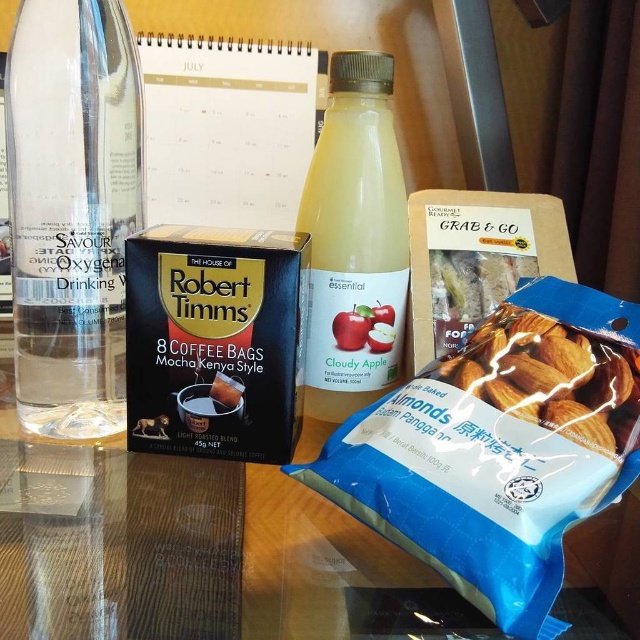
Does cloudy apple juice at center come behind smooth almond at lower right?

Yes, it is behind smooth almond at lower right.

Can you confirm if cloudy apple juice at center is positioned below smooth almond at lower right?

Incorrect, cloudy apple juice at center is not positioned below smooth almond at lower right.

Does point (356, 292) come closer to viewer compared to point (540, 406)?

That is False.

Find the location of a particular element. cloudy apple juice at center is located at coordinates (355, 241).

Measure the distance between point (x=28, y=28) and camera.

The distance of point (x=28, y=28) from camera is 16.49 inches.

In order to click on clear glass bottle at left in this screenshot , I will do `click(72, 211)`.

Locate an element on the screen. The width and height of the screenshot is (640, 640). clear glass bottle at left is located at coordinates coord(72,211).

Which is below, clear glass bottle at left or smooth almond at lower right?

Positioned lower is smooth almond at lower right.

Can you confirm if clear glass bottle at left is positioned below smooth almond at lower right?

Incorrect, clear glass bottle at left is not positioned below smooth almond at lower right.

Between point (58, 250) and point (596, 333), which one is positioned in front?

Point (596, 333)

Image resolution: width=640 pixels, height=640 pixels. What are the coordinates of `clear glass bottle at left` in the screenshot? It's located at (72, 211).